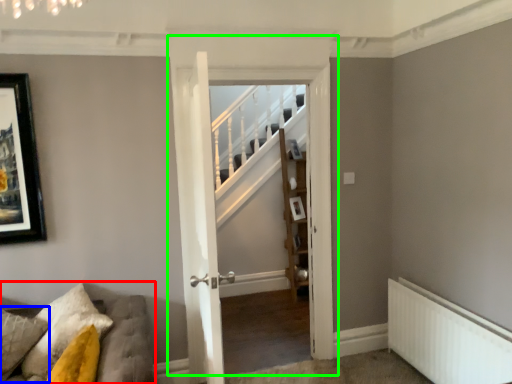
Question: Based on their relative distances, which object is nearer to furniture (highlighted by a red box)? Choose from pillow (highlighted by a blue box) and door (highlighted by a green box).

Choices:
 (A) pillow
 (B) door

Answer: (A)